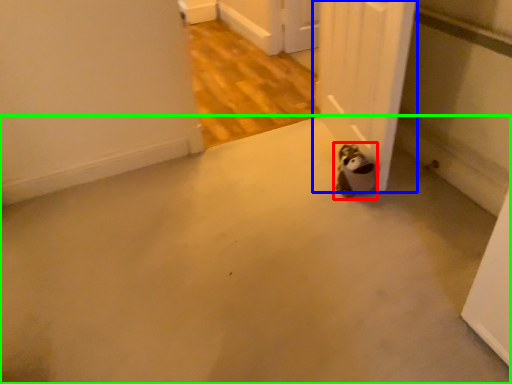
Question: Which object is positioned closest to animal (highlighted by a red box)? Select from door (highlighted by a blue box) and concrete (highlighted by a green box).

Choices:
 (A) door
 (B) concrete

Answer: (A)